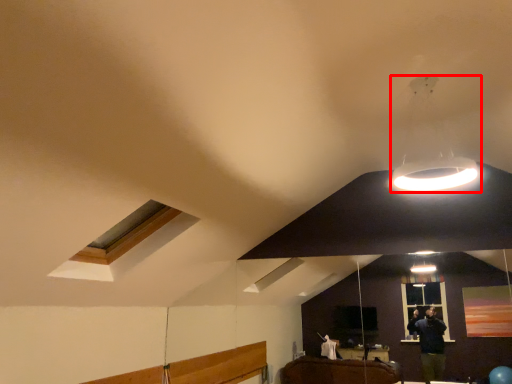
Question: Observing the image, what is the correct spatial positioning of lamp (annotated by the red box) in reference to window?

Choices:
 (A) right
 (B) left

Answer: (A)